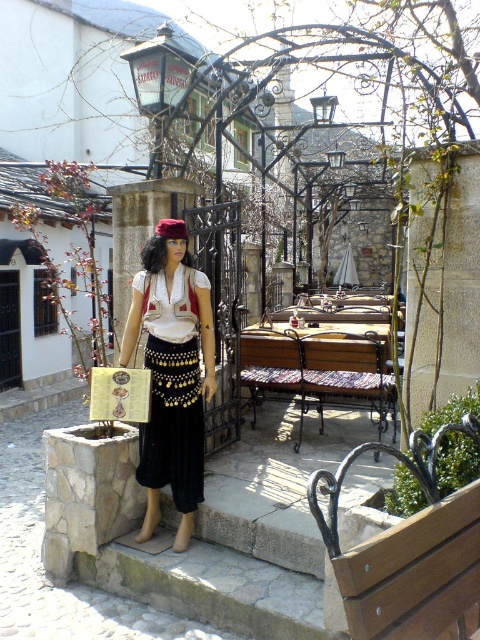
Question: Which point is farther to the camera?

Choices:
 (A) matte black skirt at center
 (B) velvet red hat at center
 (C) wooden bench at center

Answer: (C)

Question: Can you confirm if matte black skirt at center is smaller than wooden bench at center?

Choices:
 (A) no
 (B) yes

Answer: (B)

Question: Can you confirm if matte black skirt at center is thinner than wooden bench at center?

Choices:
 (A) no
 (B) yes

Answer: (B)

Question: Which point is closer to the camera taking this photo?

Choices:
 (A) (370, 384)
 (B) (168, 218)

Answer: (B)

Question: Which point is farther to the camera?

Choices:
 (A) 160,220
 (B) 187,540
 (C) 252,404

Answer: (C)

Question: Can you confirm if matte black skirt at center is positioned above velvet red hat at center?

Choices:
 (A) yes
 (B) no

Answer: (B)